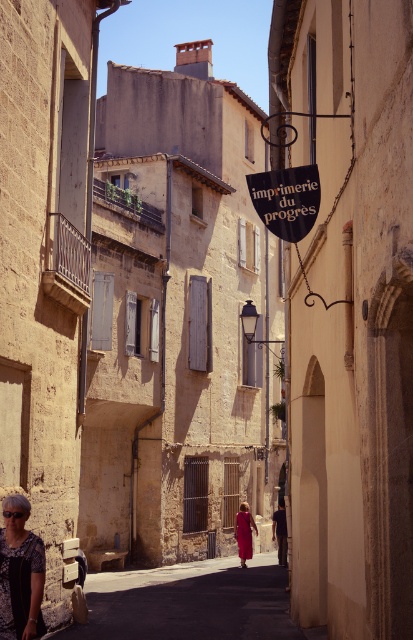
You are a tourist standing on the street and want to take a photo of the black plastic sign at center and the matte red dress at center. Which object should you zoom in on to ensure both are clearly visible in the frame?

The black plastic sign at center is wider than the matte red dress at center, so you should zoom in on the black plastic sign at center to ensure both objects are clearly visible in the frame.

You are a tour guide leading a group down this narrow street. You notice the matte black shirt at lower left and the black plastic sign at center. Which object is wider? Please explain your reasoning based on the scene.

The black plastic sign at center is wider than the matte black shirt at lower left because the description states that the matte black shirt at lower left has a smaller width.